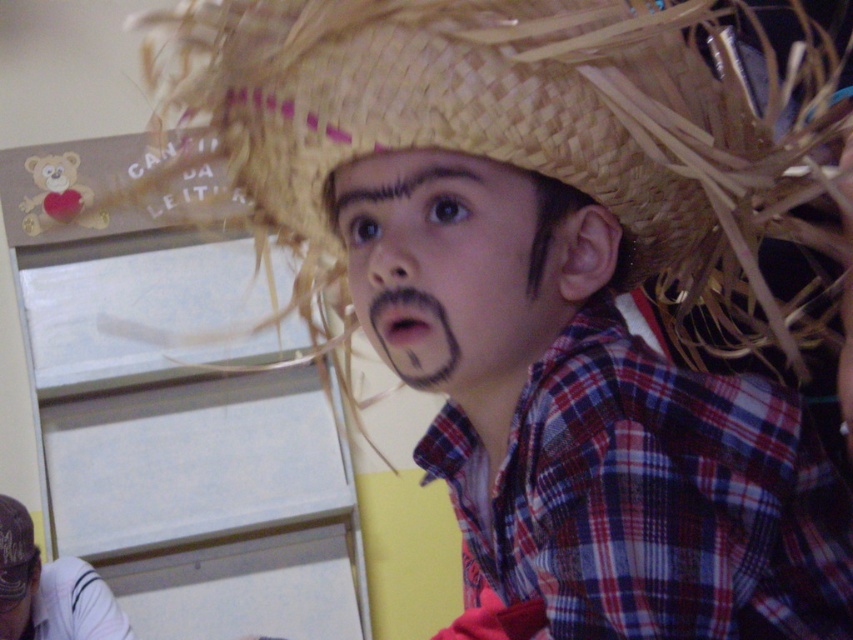
You are standing in front of the image and notice a point marked at coordinates (49,589). Based on the scene description, can you determine what object this point is located on?

The point at coordinates (49,589) is located on the white striped shirt at lower left.

The child has a black matte nose at center and a woven straw hat at upper center. Which object is closer to the viewer?

The black matte nose at center is closer to the viewer because it is in front of the woven straw hat at upper center.

You are a tailor measuring the distance between the matte straw hat at center and the white striped shirt at lower left for a custom fitting. The minimum required space for proper tailoring is 5 feet. Can you proceed with the current spacing?

The distance between the matte straw hat at center and the white striped shirt at lower left is 5.25 feet, which exceeds the 5 feet requirement. Therefore, you can proceed with the current spacing for the custom fitting.